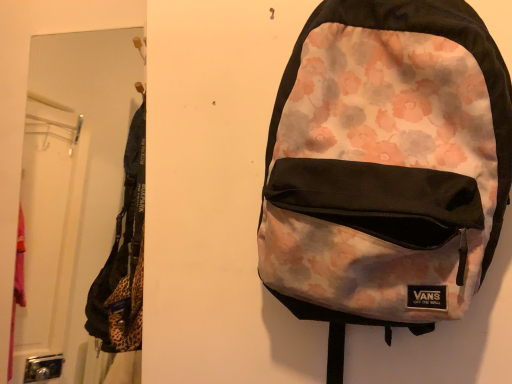
Question: From the image's perspective, is metallic silver mirror at left under floral-patterned fabric backpack at center?

Choices:
 (A) no
 (B) yes

Answer: (A)

Question: Is metallic silver mirror at left oriented away from floral-patterned fabric backpack at center?

Choices:
 (A) no
 (B) yes

Answer: (A)

Question: From the image's perspective, does metallic silver mirror at left appear higher than floral-patterned fabric backpack at center?

Choices:
 (A) no
 (B) yes

Answer: (B)

Question: Is metallic silver mirror at left outside floral-patterned fabric backpack at center?

Choices:
 (A) yes
 (B) no

Answer: (A)

Question: From a real-world perspective, does metallic silver mirror at left stand above floral-patterned fabric backpack at center?

Choices:
 (A) yes
 (B) no

Answer: (A)

Question: Is metallic silver mirror at left shorter than floral-patterned fabric backpack at center?

Choices:
 (A) no
 (B) yes

Answer: (A)

Question: Is floral-patterned fabric backpack at center outside metallic silver mirror at left?

Choices:
 (A) yes
 (B) no

Answer: (A)

Question: Does floral-patterned fabric backpack at center have a greater width compared to metallic silver mirror at left?

Choices:
 (A) no
 (B) yes

Answer: (A)

Question: From a real-world perspective, does floral-patterned fabric backpack at center stand above metallic silver mirror at left?

Choices:
 (A) yes
 (B) no

Answer: (B)

Question: Considering the relative sizes of floral-patterned fabric backpack at center and metallic silver mirror at left in the image provided, is floral-patterned fabric backpack at center shorter than metallic silver mirror at left?

Choices:
 (A) yes
 (B) no

Answer: (A)

Question: From a real-world perspective, is floral-patterned fabric backpack at center located beneath metallic silver mirror at left?

Choices:
 (A) yes
 (B) no

Answer: (A)

Question: Are floral-patterned fabric backpack at center and metallic silver mirror at left located far from each other?

Choices:
 (A) no
 (B) yes

Answer: (B)

Question: Is floral-patterned fabric backpack at center situated inside metallic silver mirror at left or outside?

Choices:
 (A) outside
 (B) inside

Answer: (A)